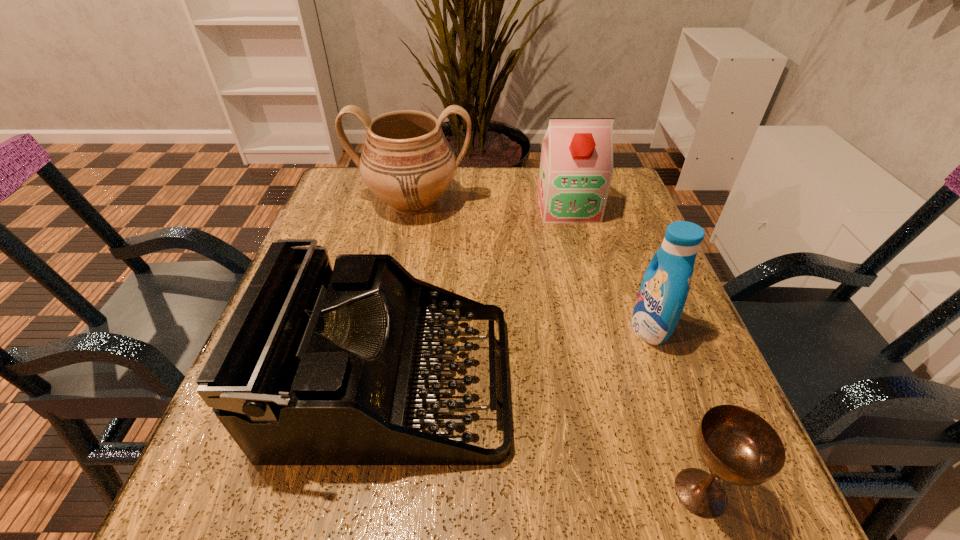
Locate which object ranks fourth in proximity to the chalice. Please provide its 2D coordinates. Your answer should be formatted as a tuple, i.e. [(x, y)], where the tuple contains the x and y coordinates of a point satisfying the conditions above.

[(407, 162)]

This screenshot has height=540, width=960. What are the coordinates of `object that stands as the fourth closest to the typewriter` in the screenshot? It's located at (576, 167).

Where is `free spot that satisfies the following two spatial constraints: 1. with the cap open on the shortest object; 2. on the left side of the soya milk`? The image size is (960, 540). free spot that satisfies the following two spatial constraints: 1. with the cap open on the shortest object; 2. on the left side of the soya milk is located at coordinates (642, 492).

In order to click on free location that satisfies the following two spatial constraints: 1. on the front-facing side of the urn; 2. on the right side of the shortest object in this screenshot , I will do `click(355, 492)`.

Identify the location of vacant position in the image that satisfies the following two spatial constraints: 1. on the front-facing side of the chalice; 2. on the left side of the urn. (355, 492).